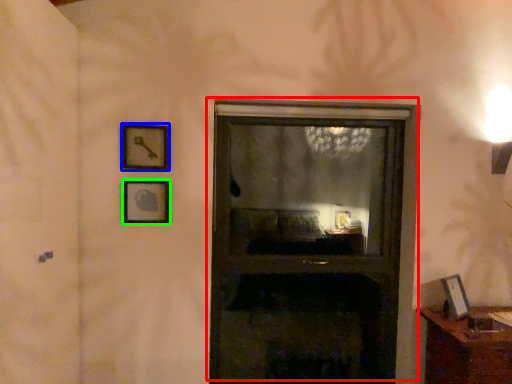
Question: Based on their relative distances, which object is nearer to window (highlighted by a red box)? Choose from picture frame (highlighted by a blue box) and picture frame (highlighted by a green box).

Choices:
 (A) picture frame
 (B) picture frame

Answer: (B)